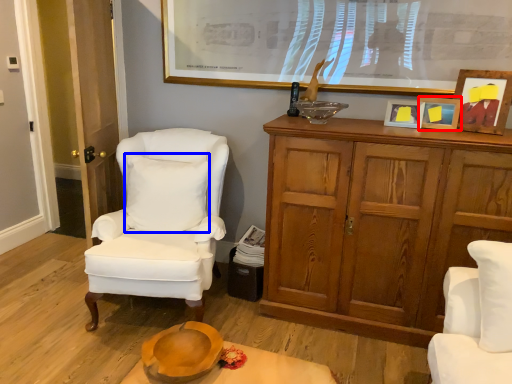
Question: Which object is further to the camera taking this photo, picture frame (highlighted by a red box) or pillow (highlighted by a blue box)?

Choices:
 (A) picture frame
 (B) pillow

Answer: (B)